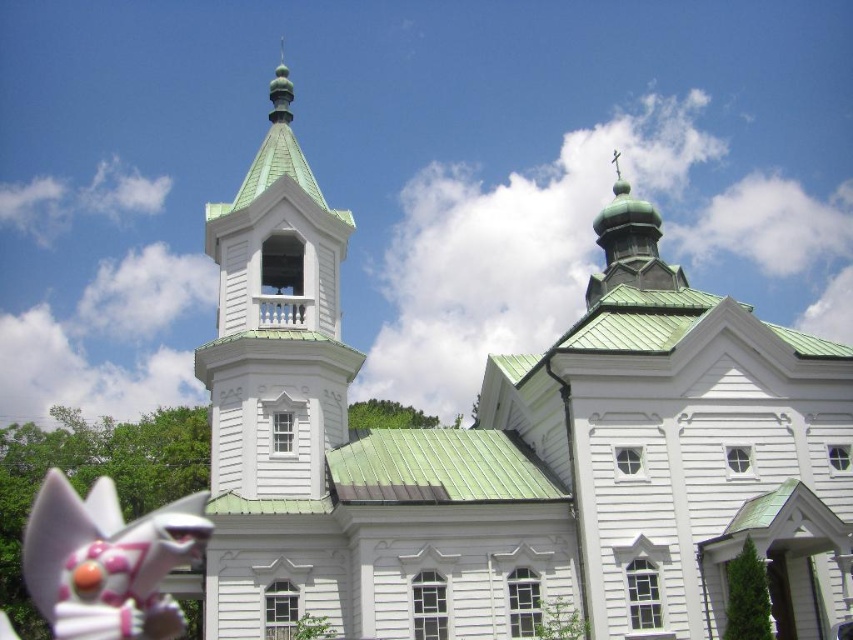
You are an architect analyzing the church design. You notice the green matte bell tower at upper center and the white glossy cat figurine at lower left. Which of these two objects is larger in size?

The green matte bell tower at upper center is bigger than the white glossy cat figurine at lower left according to the description.

You are standing in front of the church and see the green matte bell tower at upper center and the white glossy cat figurine at lower left. Which object is higher in height?

The green matte bell tower at upper center is taller than the white glossy cat figurine at lower left.

You are a drone operator trying to capture a photo of the green metallic church at upper left and the green matte bell tower at upper center. The minimum distance between the drone and any object must be 10 meters to avoid interference. Can the drone safely take the photo while maintaining this distance requirement?

The green metallic church at upper left is 8.06 meters from the green matte bell tower at upper center. Since the minimum required distance is 10 meters, the drone cannot safely take the photo while maintaining the 10 meters distance requirement between itself and both objects.